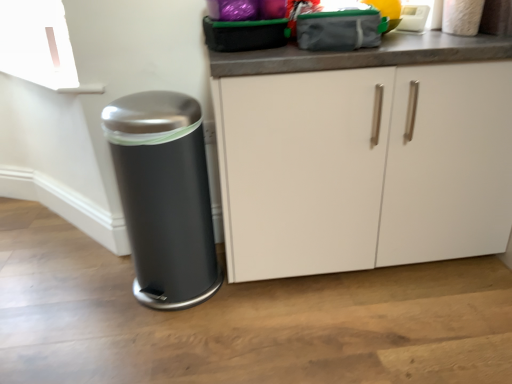
Question: Is satin black trash can at lower left in front of white matte cabinet at center?

Choices:
 (A) no
 (B) yes

Answer: (A)

Question: From the image's perspective, does satin black trash can at lower left appear higher than white matte cabinet at center?

Choices:
 (A) yes
 (B) no

Answer: (B)

Question: Is satin black trash can at lower left in contact with white matte cabinet at center?

Choices:
 (A) yes
 (B) no

Answer: (B)

Question: Considering the relative sizes of satin black trash can at lower left and white matte cabinet at center in the image provided, is satin black trash can at lower left thinner than white matte cabinet at center?

Choices:
 (A) yes
 (B) no

Answer: (A)

Question: Does satin black trash can at lower left contain white matte cabinet at center?

Choices:
 (A) yes
 (B) no

Answer: (B)

Question: In terms of width, does white matte cabinet at center look wider or thinner when compared to white plastic appliance at upper right?

Choices:
 (A) thin
 (B) wide

Answer: (B)

Question: From a real-world perspective, relative to white plastic appliance at upper right, is white matte cabinet at center vertically above or below?

Choices:
 (A) below
 (B) above

Answer: (A)

Question: Is white matte cabinet at center in front of or behind white plastic appliance at upper right in the image?

Choices:
 (A) behind
 (B) front

Answer: (B)

Question: Is white matte cabinet at center inside or outside of white plastic appliance at upper right?

Choices:
 (A) inside
 (B) outside

Answer: (B)

Question: From the image's perspective, relative to white matte cabinet at center, is satin black trash can at lower left above or below?

Choices:
 (A) below
 (B) above

Answer: (A)

Question: Would you say satin black trash can at lower left is inside or outside white matte cabinet at center?

Choices:
 (A) outside
 (B) inside

Answer: (A)

Question: Looking at their shapes, would you say satin black trash can at lower left is wider or thinner than white matte cabinet at center?

Choices:
 (A) thin
 (B) wide

Answer: (A)

Question: Relative to white matte cabinet at center, is satin black trash can at lower left in front or behind?

Choices:
 (A) front
 (B) behind

Answer: (B)

Question: Is point (417, 21) closer or farther from the camera than point (224, 152)?

Choices:
 (A) closer
 (B) farther

Answer: (B)

Question: Considering their positions, is white plastic appliance at upper right located in front of or behind white matte cabinet at center?

Choices:
 (A) behind
 (B) front

Answer: (A)